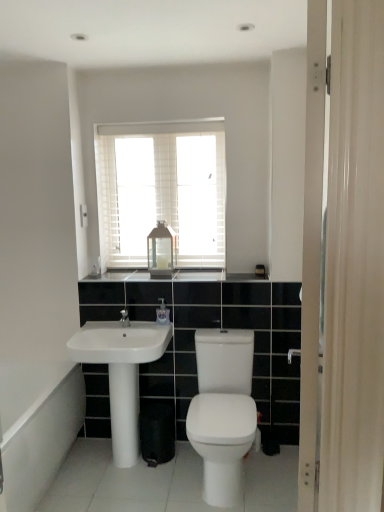
Question: Considering the positions of clear plastic soap dispenser at center and matte glass lantern at center in the image, is clear plastic soap dispenser at center taller or shorter than matte glass lantern at center?

Choices:
 (A) short
 (B) tall

Answer: (A)

Question: Relative to matte glass lantern at center, is clear plastic soap dispenser at center in front or behind?

Choices:
 (A) front
 (B) behind

Answer: (A)

Question: Which object is positioned closest to the white glossy sink at lower left?

Choices:
 (A) white glossy bidet at center
 (B) white glossy bath at lower left
 (C) white glossy pillar at center
 (D) white wooden blinds at upper center
 (E) black granite countertop at center

Answer: (C)

Question: Which of these objects is positioned closest to the black granite countertop at center?

Choices:
 (A) white glossy sink at lower left
 (B) clear plastic soap dispenser at center
 (C) white glossy bath at lower left
 (D) white glossy bidet at center
 (E) white glossy pillar at center

Answer: (B)